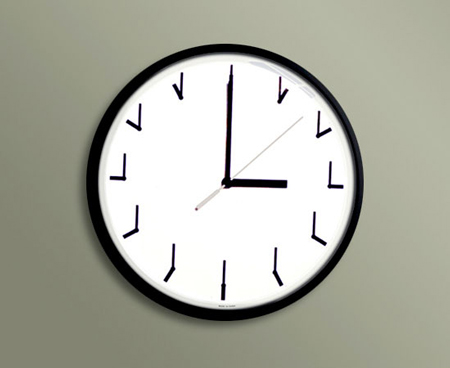
Image resolution: width=450 pixels, height=368 pixels. I want to click on clock, so tap(240, 223).